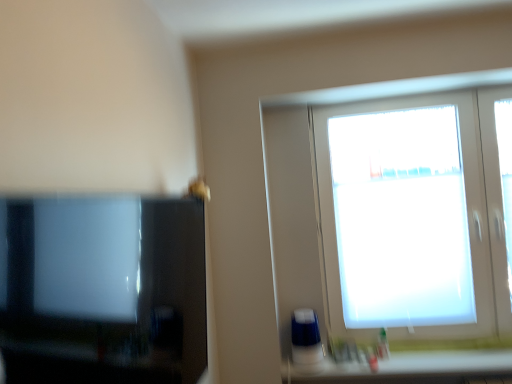
Question: Can you confirm if matte black tv at left is wider than white matte window at upper right?

Choices:
 (A) no
 (B) yes

Answer: (B)

Question: Can you confirm if matte black tv at left is shorter than white matte window at upper right?

Choices:
 (A) no
 (B) yes

Answer: (B)

Question: Could you tell me if matte black tv at left is turned towards white matte window at upper right?

Choices:
 (A) no
 (B) yes

Answer: (A)

Question: From a real-world perspective, is matte black tv at left on white matte window at upper right?

Choices:
 (A) yes
 (B) no

Answer: (B)

Question: Is matte black tv at left located outside white matte window at upper right?

Choices:
 (A) no
 (B) yes

Answer: (B)

Question: Is matte black tv at left wider or thinner than white plastic container at lower right?

Choices:
 (A) thin
 (B) wide

Answer: (A)

Question: From a real-world perspective, is matte black tv at left physically located above or below white plastic container at lower right?

Choices:
 (A) below
 (B) above

Answer: (B)

Question: Considering the relative positions of matte black tv at left and white plastic container at lower right in the image provided, is matte black tv at left to the left or to the right of white plastic container at lower right?

Choices:
 (A) right
 (B) left

Answer: (B)

Question: Considering the positions of point (135, 233) and point (500, 372), is point (135, 233) closer or farther from the camera than point (500, 372)?

Choices:
 (A) farther
 (B) closer

Answer: (B)

Question: Looking at their shapes, would you say matte black tv at left is wider or thinner than white matte window at upper right?

Choices:
 (A) wide
 (B) thin

Answer: (A)

Question: From the image's perspective, is matte black tv at left positioned above or below white matte window at upper right?

Choices:
 (A) above
 (B) below

Answer: (B)

Question: From a real-world perspective, is matte black tv at left positioned above or below white matte window at upper right?

Choices:
 (A) above
 (B) below

Answer: (B)

Question: From their relative heights in the image, would you say matte black tv at left is taller or shorter than white matte window at upper right?

Choices:
 (A) tall
 (B) short

Answer: (B)

Question: Is point (379, 345) closer or farther from the camera than point (328, 139)?

Choices:
 (A) closer
 (B) farther

Answer: (A)

Question: From the image's perspective, is translucent plastic bottle at lower right located above or below white matte window at upper right?

Choices:
 (A) above
 (B) below

Answer: (B)